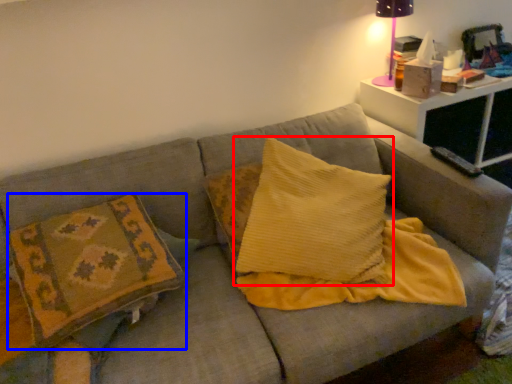
Question: Which point is closer to the camera, pillow (highlighted by a red box) or pillow (highlighted by a blue box)?

Choices:
 (A) pillow
 (B) pillow

Answer: (B)